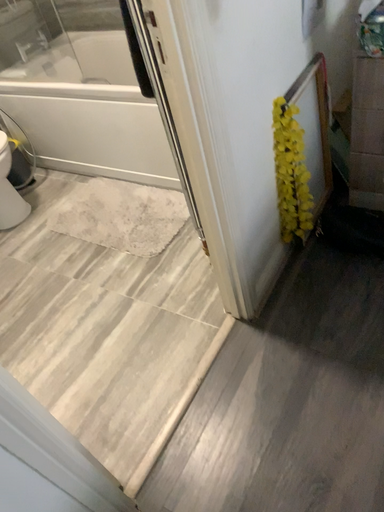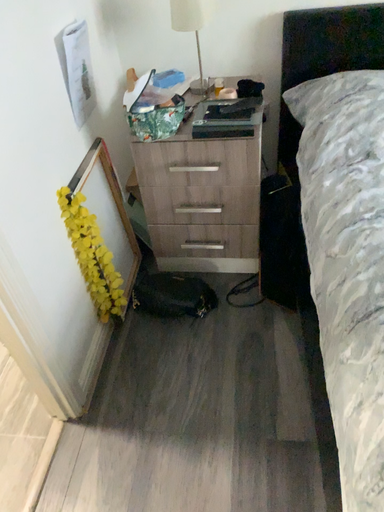
Question: How did the camera likely rotate when shooting the video?

Choices:
 (A) rotated downward
 (B) rotated upward

Answer: (B)